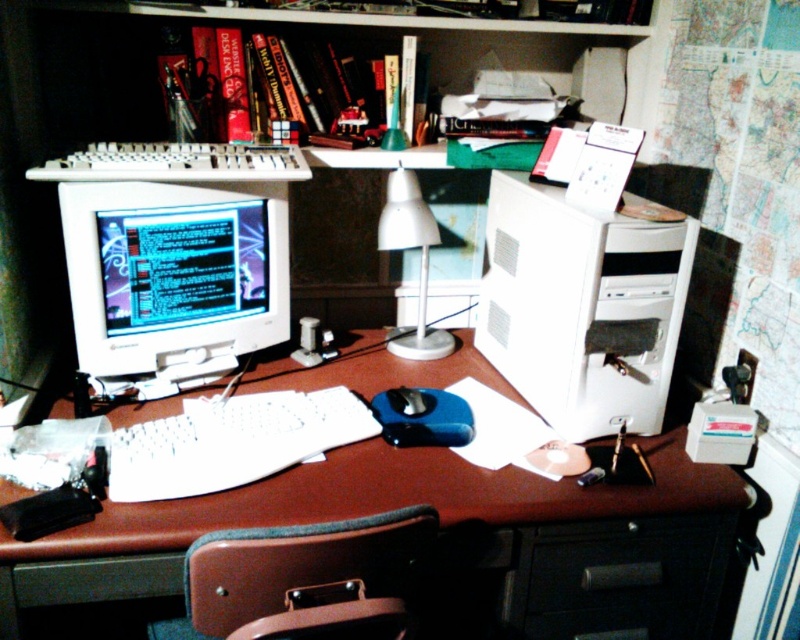
You are sitting in the brown leather swivel chair at lower center and want to reach the white plastic computer desk at center. In which direction should you move to get there?

The white plastic computer desk at center is to the right of the brown leather swivel chair at lower center, so you should move to your right to reach it.

You need to access the white plastic keyboard at center but it is currently blocked by the white plastic computer tower at right. How can you gain access to the keyboard?

The white plastic computer tower at right is positioned over the white plastic keyboard at center, so you would need to move the computer tower to access the keyboard.

You are setting up a new monitor stand and need to know the size relationship between the white plastic computer tower at right and the white plastic keyboard at center. Which one is larger?

The white plastic computer tower at right is bigger than the white plastic keyboard at center.